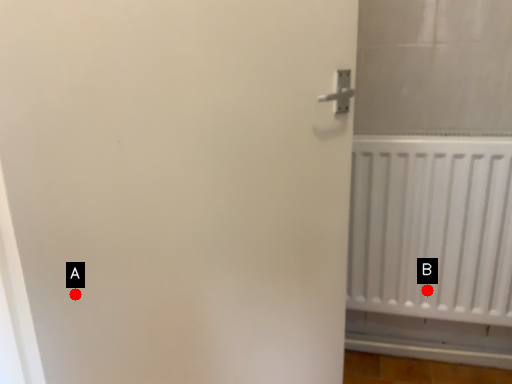
Question: Two points are circled on the image, labeled by A and B beside each circle. Which point is further to the camera?

Choices:
 (A) A is further
 (B) B is further

Answer: (B)